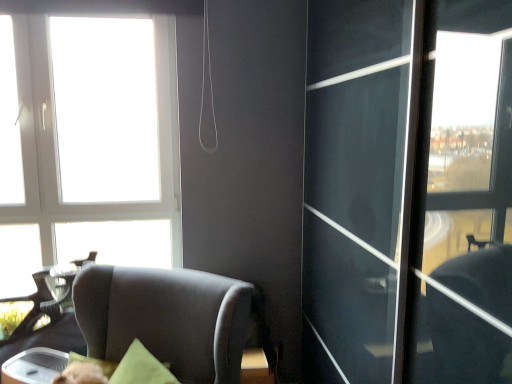
The image size is (512, 384). What do you see at coordinates (88, 143) in the screenshot? I see `white plastic window at upper left` at bounding box center [88, 143].

Measure the distance between white plastic window at upper left and camera.

6.93 feet.

The image size is (512, 384). I want to click on white plastic window at upper left, so click(x=88, y=143).

I want to click on suede-like brown chair at lower left, so coord(166,318).

The height and width of the screenshot is (384, 512). Describe the element at coordinates (166, 318) in the screenshot. I see `suede-like brown chair at lower left` at that location.

The height and width of the screenshot is (384, 512). I want to click on white plastic window at upper left, so click(x=88, y=143).

Does suede-like brown chair at lower left appear on the right side of white plastic window at upper left?

Indeed, suede-like brown chair at lower left is positioned on the right side of white plastic window at upper left.

Is suede-like brown chair at lower left behind white plastic window at upper left?

That is False.

Is point (128, 341) closer or farther from the camera than point (147, 84)?

Point (128, 341).

From the image's perspective, which is below, suede-like brown chair at lower left or white plastic window at upper left?

suede-like brown chair at lower left appears lower in the image.

From a real-world perspective, is suede-like brown chair at lower left located beneath white plastic window at upper left?

Yes.

Which of these two, suede-like brown chair at lower left or white plastic window at upper left, is thinner?

white plastic window at upper left is thinner.

Can you confirm if suede-like brown chair at lower left is shorter than white plastic window at upper left?

Yes, suede-like brown chair at lower left is shorter than white plastic window at upper left.

Considering the sizes of suede-like brown chair at lower left and white plastic window at upper left in the image, is suede-like brown chair at lower left bigger or smaller than white plastic window at upper left?

suede-like brown chair at lower left is bigger than white plastic window at upper left.

Would you say suede-like brown chair at lower left contains white plastic window at upper left?

No.

Is suede-like brown chair at lower left not close to white plastic window at upper left?

No, suede-like brown chair at lower left is not far away from white plastic window at upper left.

Is suede-like brown chair at lower left looking in the opposite direction of white plastic window at upper left?

suede-like brown chair at lower left does not have its back to white plastic window at upper left.

How different are the orientations of suede-like brown chair at lower left and white plastic window at upper left in degrees?

31.9 degrees separate the facing orientations of suede-like brown chair at lower left and white plastic window at upper left.

Locate an element on the screen. The image size is (512, 384). chair that is in front of the white plastic window at upper left is located at coordinates (166, 318).

Considering the positions of objects white plastic window at upper left and suede-like brown chair at lower left in the image provided, who is more to the right, white plastic window at upper left or suede-like brown chair at lower left?

suede-like brown chair at lower left is more to the right.

Which is in front, white plastic window at upper left or suede-like brown chair at lower left?

Positioned in front is suede-like brown chair at lower left.

Which is farther, (76, 96) or (159, 321)?

The point (76, 96) is farther.

From the image's perspective, is white plastic window at upper left over suede-like brown chair at lower left?

Yes, from the image's perspective, white plastic window at upper left is above suede-like brown chair at lower left.

From a real-world perspective, is white plastic window at upper left under suede-like brown chair at lower left?

Actually, white plastic window at upper left is physically above suede-like brown chair at lower left in the real world.

Does white plastic window at upper left have a greater width compared to suede-like brown chair at lower left?

No.

Considering the sizes of objects white plastic window at upper left and suede-like brown chair at lower left in the image provided, who is taller, white plastic window at upper left or suede-like brown chair at lower left?

white plastic window at upper left.

Looking at the image, does white plastic window at upper left seem bigger or smaller compared to suede-like brown chair at lower left?

In the image, white plastic window at upper left appears to be smaller than suede-like brown chair at lower left.

Is suede-like brown chair at lower left completely or partially inside white plastic window at upper left?

No.

Is white plastic window at upper left next to suede-like brown chair at lower left?

white plastic window at upper left and suede-like brown chair at lower left are not in contact.

Is white plastic window at upper left looking in the opposite direction of suede-like brown chair at lower left?

That's not correct — white plastic window at upper left is not looking away from suede-like brown chair at lower left.

This screenshot has height=384, width=512. I want to click on chair located below the white plastic window at upper left (from the image's perspective), so click(166, 318).

Find the location of a particular element. window that appears above the suede-like brown chair at lower left (from a real-world perspective) is located at coordinates (88, 143).

You are a GUI agent. You are given a task and a screenshot of the screen. Output one action in this format:
    pyautogui.click(x=<x>, y=<y>)
    Task: Click on the chair in front of the white plastic window at upper left
    The height and width of the screenshot is (384, 512).
    Given the screenshot: What is the action you would take?
    pyautogui.click(x=166, y=318)